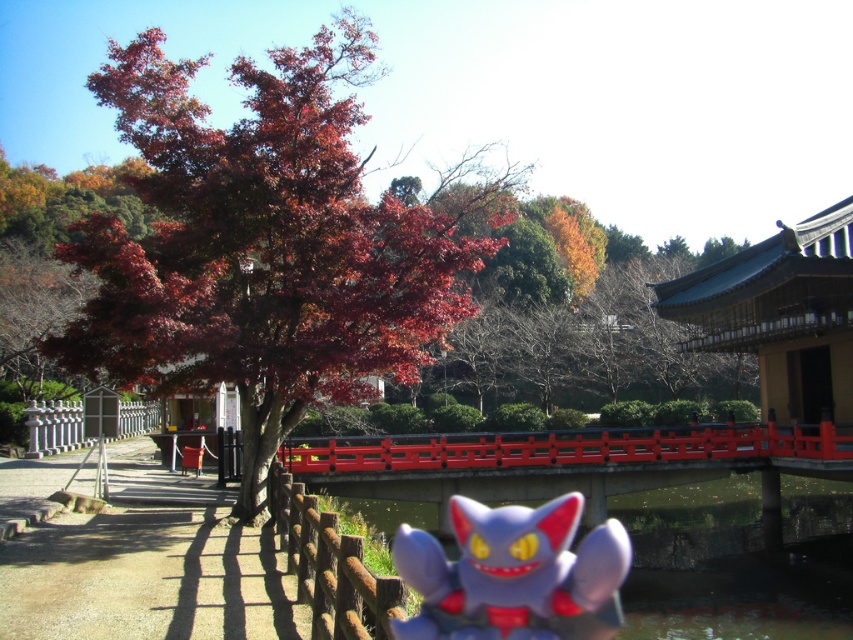
Question: Which object appears closest to the camera in this image?

Choices:
 (A) white glossy fence at left
 (B) brown wooden fence at lower center
 (C) shiny red maple tree at upper left
 (D) smooth red bridge at center

Answer: (B)

Question: Which of the following is the farthest from the observer?

Choices:
 (A) shiny red maple tree at upper left
 (B) white glossy fence at left
 (C) smooth red bridge at center
 (D) plush gray toy at center

Answer: (B)

Question: Which point is farther from the camera taking this photo?

Choices:
 (A) (392, 580)
 (B) (79, 442)
 (C) (286, 156)

Answer: (B)

Question: Does shiny red maple tree at upper left lie in front of plush gray toy at center?

Choices:
 (A) yes
 (B) no

Answer: (B)

Question: Can you confirm if shiny red maple tree at upper left is positioned above plush gray toy at center?

Choices:
 (A) yes
 (B) no

Answer: (A)

Question: From the image, what is the correct spatial relationship of smooth red bridge at center in relation to brown wooden fence at lower center?

Choices:
 (A) left
 (B) right

Answer: (B)